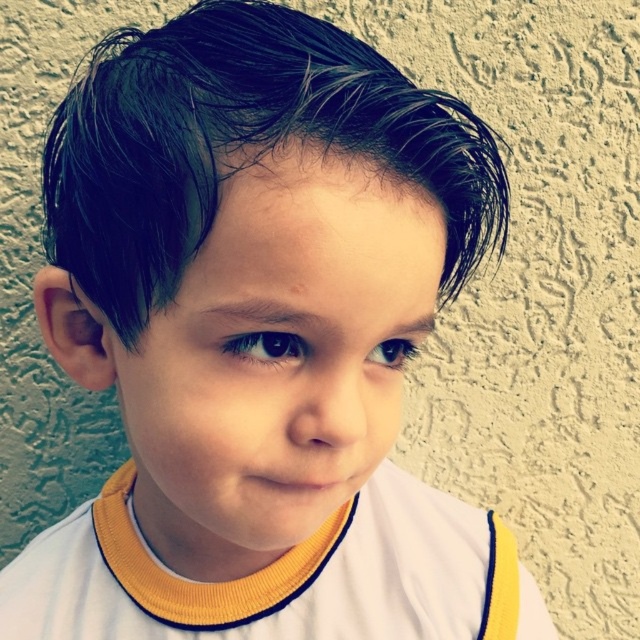
Question: Is wet black hair at center above white jersey at center?

Choices:
 (A) yes
 (B) no

Answer: (A)

Question: Is wet black hair at center smaller than white jersey at center?

Choices:
 (A) no
 (B) yes

Answer: (A)

Question: Which of the following is the farthest from the observer?

Choices:
 (A) white jersey at center
 (B) wet black hair at center

Answer: (A)

Question: Which of the following is the closest to the observer?

Choices:
 (A) wet black hair at center
 (B) white jersey at center

Answer: (A)

Question: Does wet black hair at center have a greater width compared to white jersey at center?

Choices:
 (A) yes
 (B) no

Answer: (B)